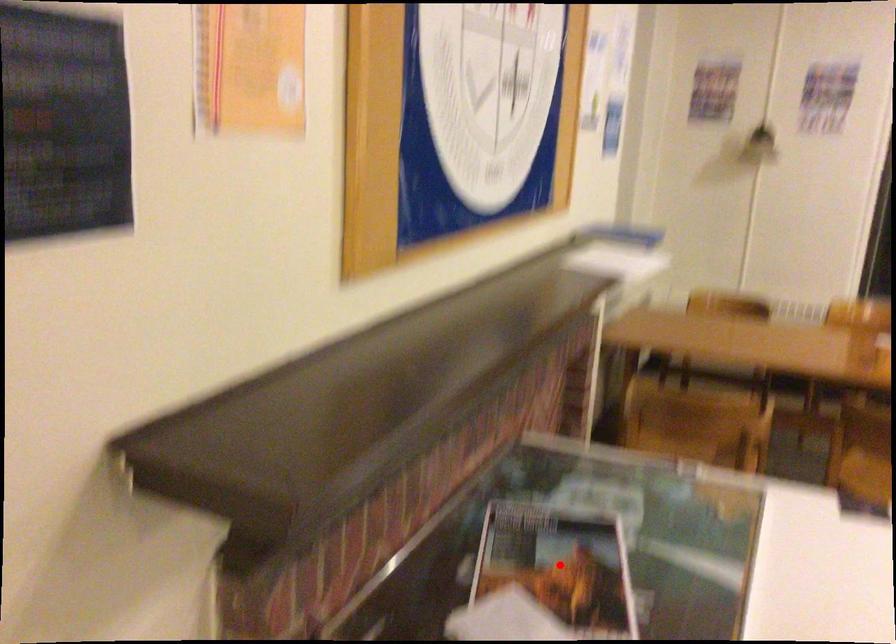
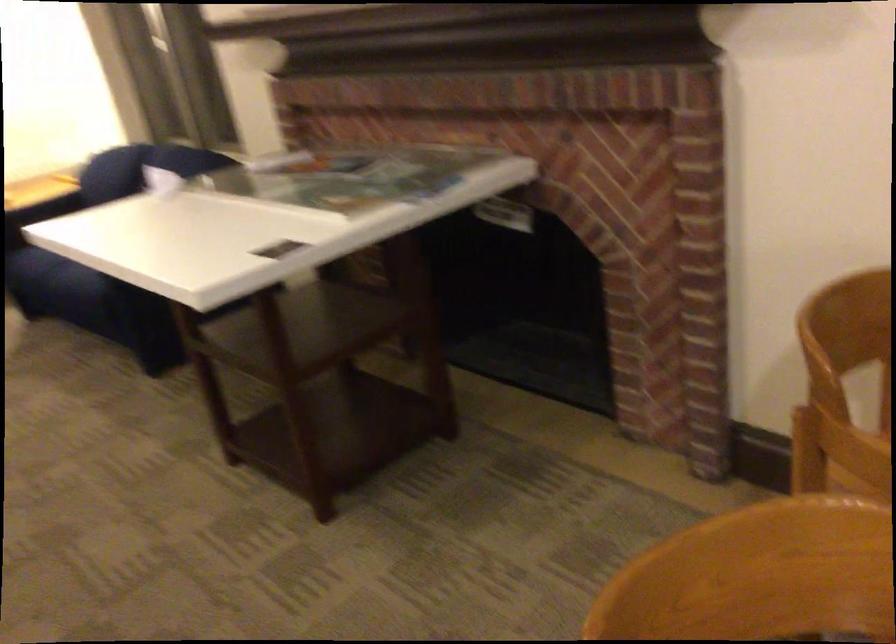
Question: I am providing you with two images of the same scene from different viewpoints. A red point is marked on the first image. Is the red point's position out of view in image 2?

Choices:
 (A) Yes
 (B) No

Answer: (A)